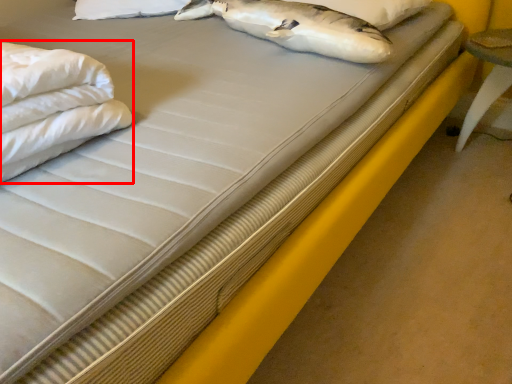
Question: Where is sheet (annotated by the red box) located in relation to pillow in the image?

Choices:
 (A) right
 (B) left

Answer: (B)